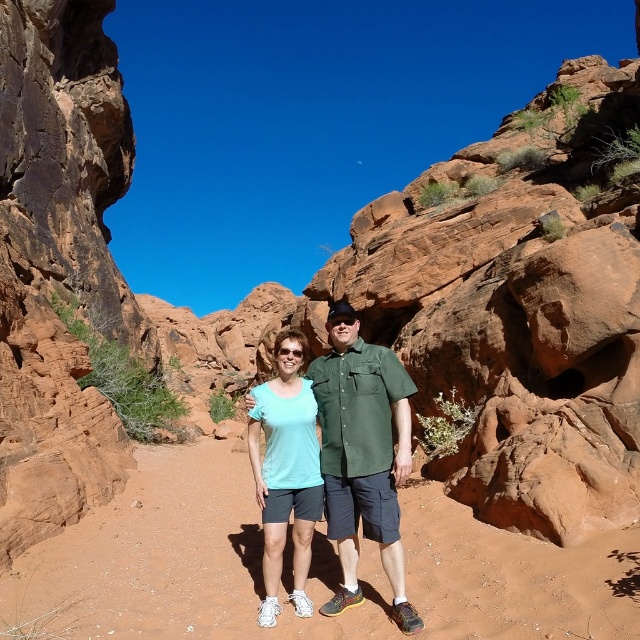
Can you confirm if sandy soil at center is smaller than rustic sandstone rock at left?

Yes, sandy soil at center is smaller than rustic sandstone rock at left.

Is sandy soil at center taller than rustic sandstone rock at left?

In fact, sandy soil at center may be shorter than rustic sandstone rock at left.

Between point (536, 612) and point (77, 388), which one is positioned in front?

Point (536, 612)

Find the location of a particular element. This screenshot has width=640, height=640. sandy soil at center is located at coordinates (310, 566).

Does sandy soil at center have a lesser width compared to matte green shirt at center?

Incorrect, sandy soil at center's width is not less than matte green shirt at center's.

Can you confirm if sandy soil at center is taller than matte green shirt at center?

No.

Who is more forward, [477,524] or [385,468]?

Point [385,468] is in front.

You are a GUI agent. You are given a task and a screenshot of the screen. Output one action in this format:
    pyautogui.click(x=<x>, y=<y>)
    Task: Click on the sandy soil at center
    This screenshot has width=640, height=640.
    Given the screenshot: What is the action you would take?
    pyautogui.click(x=310, y=566)

Between point (211, 525) and point (280, 564), which one is positioned behind?

The point (211, 525) is behind.

In the scene shown: Does sandy soil at center have a greater width compared to matte teal shirt at center?

Correct, the width of sandy soil at center exceeds that of matte teal shirt at center.

Between point (116, 561) and point (266, 483), which one is positioned in front?

Point (266, 483)

This screenshot has height=640, width=640. I want to click on sandy soil at center, so click(310, 566).